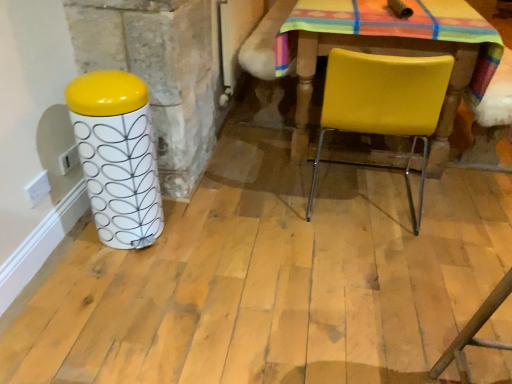
Question: Considering the relative sizes of yellow leather chair at center and white glossy patterned canister at left in the image provided, is yellow leather chair at center smaller than white glossy patterned canister at left?

Choices:
 (A) no
 (B) yes

Answer: (A)

Question: Is yellow leather chair at center to the right of white glossy patterned canister at left from the viewer's perspective?

Choices:
 (A) no
 (B) yes

Answer: (B)

Question: Does yellow leather chair at center touch white glossy patterned canister at left?

Choices:
 (A) yes
 (B) no

Answer: (B)

Question: Does yellow leather chair at center lie in front of white glossy patterned canister at left?

Choices:
 (A) yes
 (B) no

Answer: (B)

Question: Can you confirm if yellow leather chair at center is shorter than white glossy patterned canister at left?

Choices:
 (A) yes
 (B) no

Answer: (B)

Question: Does yellow leather chair at center come behind white glossy patterned canister at left?

Choices:
 (A) no
 (B) yes

Answer: (B)

Question: Does white glossy patterned canister at left come in front of yellow leather chair at center?

Choices:
 (A) yes
 (B) no

Answer: (A)

Question: Does white glossy patterned canister at left have a greater height compared to yellow leather chair at center?

Choices:
 (A) no
 (B) yes

Answer: (A)

Question: From a real-world perspective, does white glossy patterned canister at left stand above yellow leather chair at center?

Choices:
 (A) yes
 (B) no

Answer: (B)

Question: Does white glossy patterned canister at left appear on the right side of yellow leather chair at center?

Choices:
 (A) no
 (B) yes

Answer: (A)

Question: Is yellow leather chair at center at the back of white glossy patterned canister at left?

Choices:
 (A) no
 (B) yes

Answer: (A)

Question: Considering the relative sizes of white glossy patterned canister at left and yellow leather chair at center in the image provided, is white glossy patterned canister at left thinner than yellow leather chair at center?

Choices:
 (A) no
 (B) yes

Answer: (B)

Question: Considering the relative positions of white glossy patterned canister at left and yellow leather chair at center in the image provided, is white glossy patterned canister at left to the left or to the right of yellow leather chair at center?

Choices:
 (A) right
 (B) left

Answer: (B)